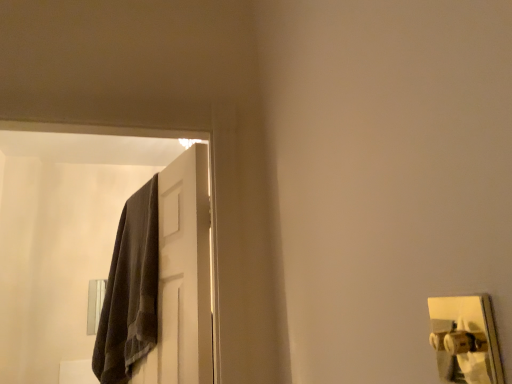
Where is `white matte door at upper left`? The image size is (512, 384). white matte door at upper left is located at coordinates pos(182,277).

What do you see at coordinates (182, 277) in the screenshot? Image resolution: width=512 pixels, height=384 pixels. I see `white matte door at upper left` at bounding box center [182, 277].

Measure the distance between metallic gold door handle at upper right and camera.

metallic gold door handle at upper right and camera are 1.80 meters apart.

What do you see at coordinates (465, 339) in the screenshot?
I see `metallic gold door handle at upper right` at bounding box center [465, 339].

Where is `metallic gold door handle at upper right`? The image size is (512, 384). metallic gold door handle at upper right is located at coordinates (465, 339).

The image size is (512, 384). Find the location of `white matte door at upper left`. white matte door at upper left is located at coordinates (182, 277).

Which is more to the right, metallic gold door handle at upper right or white matte door at upper left?

metallic gold door handle at upper right.

Consider the image. Is metallic gold door handle at upper right positioned before white matte door at upper left?

Yes, it is in front of white matte door at upper left.

Is point (490, 328) farther from viewer compared to point (147, 377)?

No, (490, 328) is closer to viewer.

In the scene shown: From the image's perspective, is metallic gold door handle at upper right under white matte door at upper left?

Incorrect, from the image's perspective, metallic gold door handle at upper right is higher than white matte door at upper left.

From a real-world perspective, is metallic gold door handle at upper right positioned under white matte door at upper left based on gravity?

Yes, from a real-world perspective, metallic gold door handle at upper right is beneath white matte door at upper left.

Considering the sizes of objects metallic gold door handle at upper right and white matte door at upper left in the image provided, who is wider, metallic gold door handle at upper right or white matte door at upper left?

Wider between the two is metallic gold door handle at upper right.

Can you confirm if metallic gold door handle at upper right is shorter than white matte door at upper left?

Indeed, metallic gold door handle at upper right has a lesser height compared to white matte door at upper left.

Between metallic gold door handle at upper right and white matte door at upper left, which one has larger size?

white matte door at upper left.

Is white matte door at upper left completely or partially inside metallic gold door handle at upper right?

No, metallic gold door handle at upper right does not contain white matte door at upper left.

Is there a large distance between metallic gold door handle at upper right and white matte door at upper left?

metallic gold door handle at upper right is positioned a significant distance from white matte door at upper left.

Based on the photo, does metallic gold door handle at upper right turn towards white matte door at upper left?

No, metallic gold door handle at upper right does not turn towards white matte door at upper left.

How different are the orientations of metallic gold door handle at upper right and white matte door at upper left in degrees?

18.3 degrees separate the facing orientations of metallic gold door handle at upper right and white matte door at upper left.

The image size is (512, 384). In order to click on door located below the metallic gold door handle at upper right (from the image's perspective) in this screenshot , I will do `click(182, 277)`.

Considering the positions of objects white matte door at upper left and metallic gold door handle at upper right in the image provided, who is more to the right, white matte door at upper left or metallic gold door handle at upper right?

Positioned to the right is metallic gold door handle at upper right.

Who is more distant, white matte door at upper left or metallic gold door handle at upper right?

white matte door at upper left is behind.

Does point (182, 383) come closer to viewer compared to point (428, 299)?

No, it is behind (428, 299).

From the image's perspective, between white matte door at upper left and metallic gold door handle at upper right, who is located below?

From the image's view, white matte door at upper left is below.

From a real-world perspective, is white matte door at upper left physically located above or below metallic gold door handle at upper right?

white matte door at upper left is above metallic gold door handle at upper right.

Can you confirm if white matte door at upper left is thinner than metallic gold door handle at upper right?

Yes, white matte door at upper left is thinner than metallic gold door handle at upper right.

Who is taller, white matte door at upper left or metallic gold door handle at upper right?

white matte door at upper left.

Is white matte door at upper left bigger or smaller than metallic gold door handle at upper right?

In the image, white matte door at upper left appears to be larger than metallic gold door handle at upper right.

Could metallic gold door handle at upper right be considered to be inside white matte door at upper left?

Definitely not — metallic gold door handle at upper right is not inside white matte door at upper left.

Are white matte door at upper left and metallic gold door handle at upper right beside each other?

No, white matte door at upper left is not next to metallic gold door handle at upper right.

Is white matte door at upper left looking in the opposite direction of metallic gold door handle at upper right?

No, metallic gold door handle at upper right is not at the back of white matte door at upper left.

You are a GUI agent. You are given a task and a screenshot of the screen. Output one action in this format:
    pyautogui.click(x=<x>, y=<y>)
    Task: Click on the door located behind the metallic gold door handle at upper right
    This screenshot has width=512, height=384.
    Given the screenshot: What is the action you would take?
    pyautogui.click(x=182, y=277)

Where is `door handle below the white matte door at upper left (from a real-world perspective)`? Image resolution: width=512 pixels, height=384 pixels. door handle below the white matte door at upper left (from a real-world perspective) is located at coordinates (465, 339).

I want to click on door above the metallic gold door handle at upper right (from a real-world perspective), so click(182, 277).